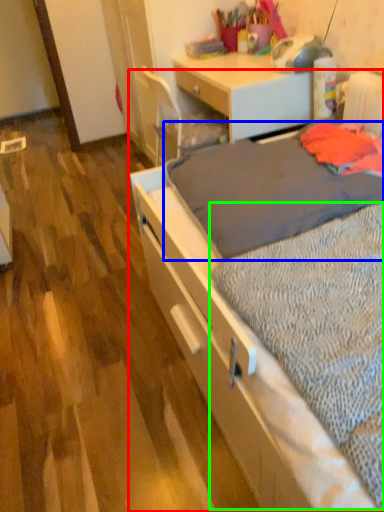
Question: Based on their relative distances, which object is farther from bed (highlighted by a red box)? Choose from blanket (highlighted by a blue box) and sheet (highlighted by a green box).

Choices:
 (A) blanket
 (B) sheet

Answer: (A)